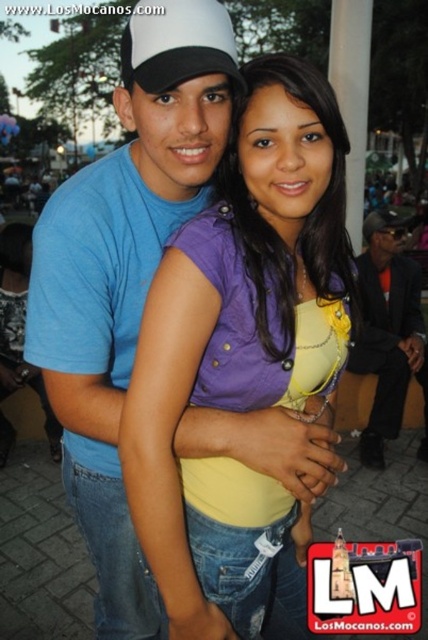
Who is taller, purple denim shirt at center or blue cotton t-shirt at upper left?

With more height is blue cotton t-shirt at upper left.

Who is shorter, purple denim shirt at center or blue cotton t-shirt at upper left?

Standing shorter between the two is purple denim shirt at center.

Which is behind, point (157, 291) or point (88, 326)?

Positioned behind is point (88, 326).

At what (x,y) coordinates should I click in order to perform the action: click on purple denim shirt at center. Please return your answer as a coordinate pair (x, y). Image resolution: width=428 pixels, height=640 pixels. Looking at the image, I should click on (243, 355).

Which is behind, point (247, 525) or point (133, 36)?

Positioned behind is point (247, 525).

How distant is purple denim shirt at center from white matte baseball cap at upper center?

purple denim shirt at center is 27.75 inches from white matte baseball cap at upper center.

Who is more distant from viewer, (344,225) or (201,1)?

Positioned behind is point (344,225).

The image size is (428, 640). I want to click on purple denim shirt at center, so click(243, 355).

Can you confirm if purple denim shirt at center is positioned to the right of orange fabric suit at right?

Incorrect, purple denim shirt at center is not on the right side of orange fabric suit at right.

The height and width of the screenshot is (640, 428). What do you see at coordinates (243, 355) in the screenshot? I see `purple denim shirt at center` at bounding box center [243, 355].

You are a GUI agent. You are given a task and a screenshot of the screen. Output one action in this format:
    pyautogui.click(x=<x>, y=<y>)
    Task: Click on the purple denim shirt at center
    The width and height of the screenshot is (428, 640).
    Given the screenshot: What is the action you would take?
    pyautogui.click(x=243, y=355)